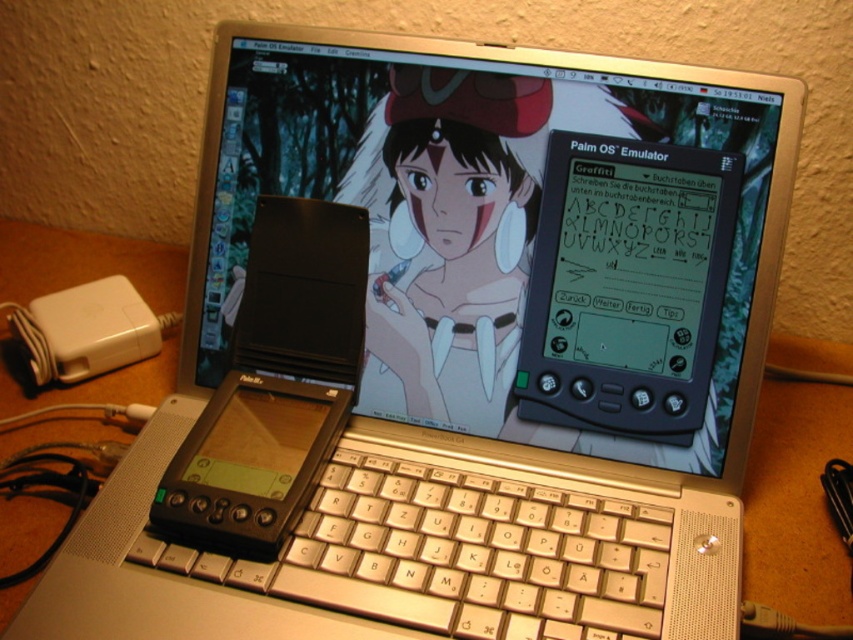
You are setting up a workspace and need to place both the black plastic palm pilot at center and the white plastic power adapter at lower left on a desk. The desk has a 20 cm wide space between them. Can they be placed without overlapping?

The black plastic palm pilot at center is 22.67 centimeters away from the white plastic power adapter at lower left. Since the required space between them is 20 cm, they cannot be placed without overlapping as the distance is insufficient.

You are setting up a laptop and need to place both the black plastic palm pilot at center and the white plastic power adapter at lower left on the desk. If you want to stack them vertically, which one should go on the bottom to ensure stability?

The white plastic power adapter at lower left should go on the bottom because it is thicker than the black plastic palm pilot at center, providing a more stable base for stacking.

You are looking at the laptop screen and notice two points marked on it. Which point, point (277, 205) or point (68, 333), appears closer to you?

Point (277, 205) is closer to the camera than point (68, 333).